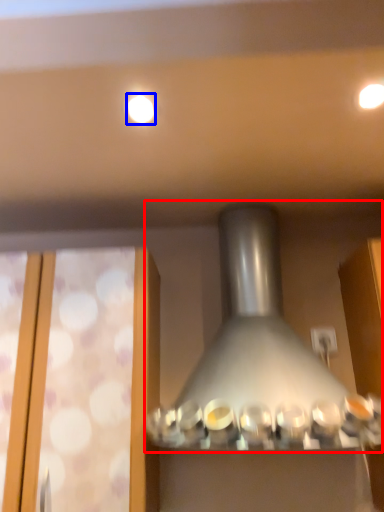
Question: Which of the following is the farthest to the observer, lamp (highlighted by a red box) or lighting (highlighted by a blue box)?

Choices:
 (A) lamp
 (B) lighting

Answer: (B)